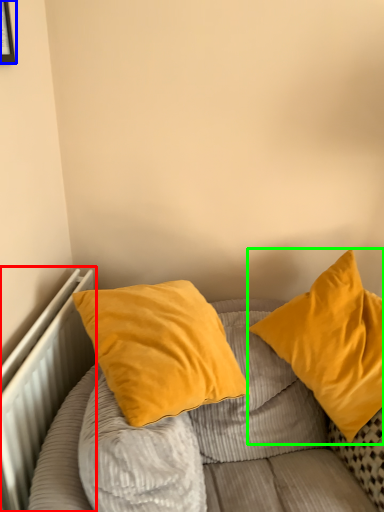
Question: Based on their relative distances, which object is nearer to radiator (highlighted by a red box)? Choose from picture frame (highlighted by a blue box) and pillow (highlighted by a green box).

Choices:
 (A) picture frame
 (B) pillow

Answer: (B)